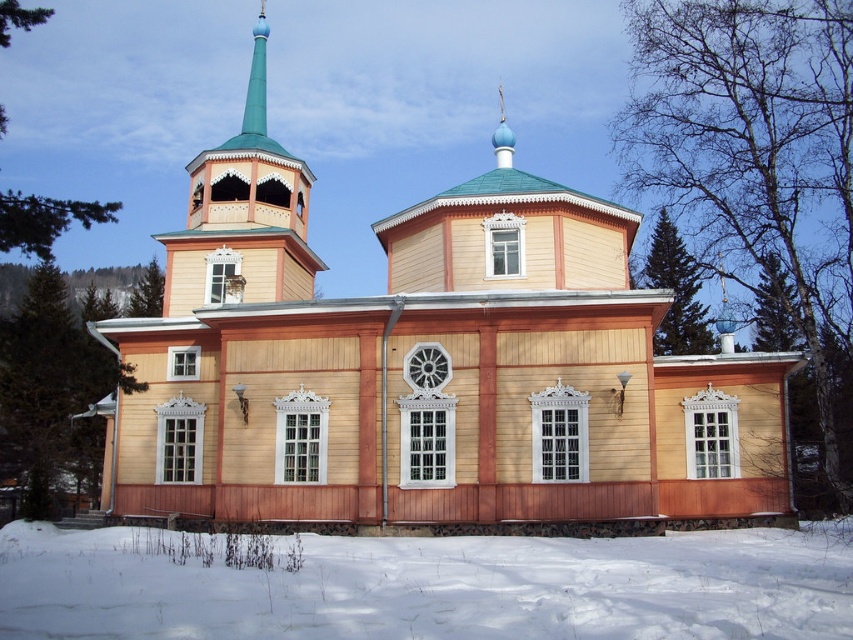
Question: Can you confirm if wooden church at center is positioned below white powdery snow at lower center?

Choices:
 (A) yes
 (B) no

Answer: (B)

Question: Does wooden church at center appear on the left side of white powdery snow at lower center?

Choices:
 (A) no
 (B) yes

Answer: (B)

Question: Which of the following is the closest to the observer?

Choices:
 (A) [x=498, y=305]
 (B) [x=260, y=582]

Answer: (B)

Question: Where is wooden church at center located in relation to white powdery snow at lower center in the image?

Choices:
 (A) below
 (B) above

Answer: (B)